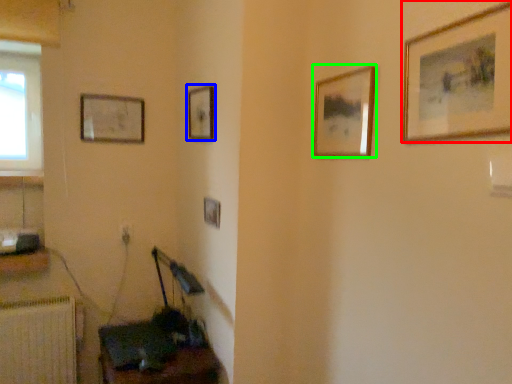
Question: Which object is the closest to the picture frame (highlighted by a red box)? Choose among these: picture frame (highlighted by a blue box) or picture frame (highlighted by a green box).

Choices:
 (A) picture frame
 (B) picture frame

Answer: (B)